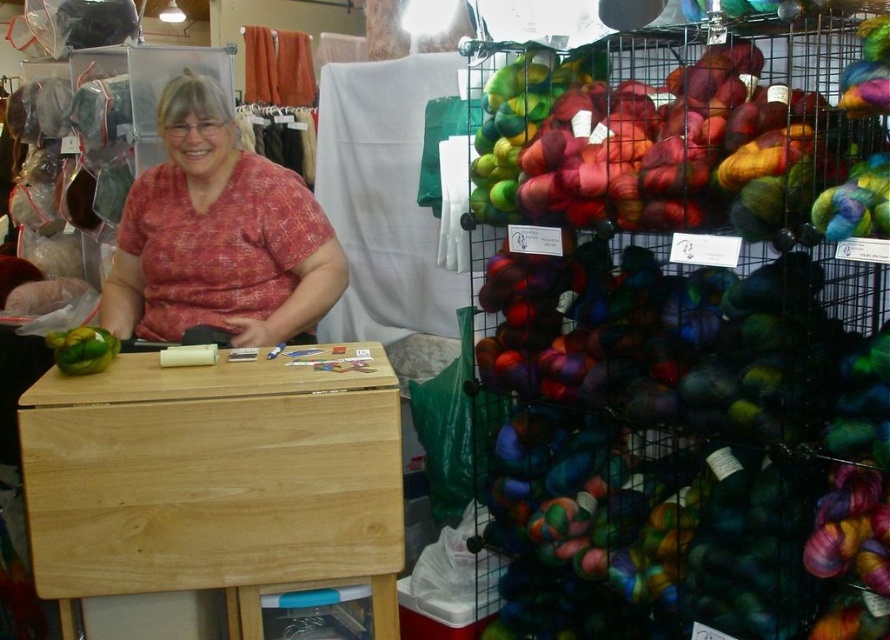
You are a customer in the craft store and want to place a large box on the table. The box is wider than the matte red shirt at center. Can you fit it between the multicolored yarn at right and the table edge?

The multicolored yarn at right is wider than the matte red shirt at center. Since the box is wider than the matte red shirt at center, it may not fit between the multicolored yarn at right and the table edge if the space available is narrower than the box.

You are a customer in the craft store looking to buy yarn. You see the multicolored yarn at right and the matte red shirt at center. Which item is higher up on the shelf?

The multicolored yarn at right is taller than the matte red shirt at center, so it is higher up on the shelf.

Consider the image. You are a customer in a craft store looking for the multicolored yarn at right. According to the store layout, where should you look to find it?

The multicolored yarn at right is located at point (x=684, y=342) in the store layout.